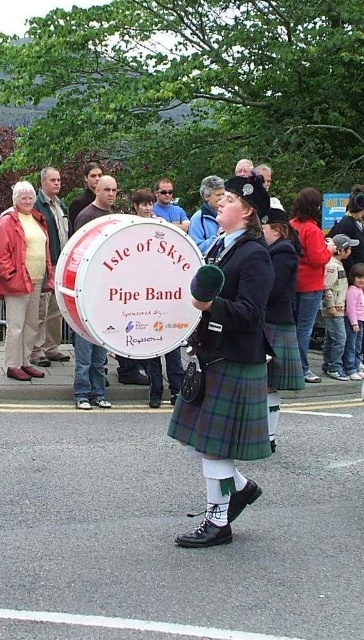
Can you confirm if matte green jacket at upper left is positioned below gray hair at upper center?

Yes.

Which is behind, point (41, 352) or point (250, 170)?

The point (250, 170) is behind.

Which is in front, point (49, 212) or point (239, 161)?

Point (49, 212) is more forward.

At what (x,y) coordinates should I click in order to perform the action: click on matte green jacket at upper left. Please return your answer as a coordinate pair (x, y). Image resolution: width=364 pixels, height=640 pixels. Looking at the image, I should click on (52, 211).

Does plaid fabric kilt at center have a greater height compared to matte black drum at upper center?

Indeed, plaid fabric kilt at center has a greater height compared to matte black drum at upper center.

The height and width of the screenshot is (640, 364). I want to click on plaid fabric kilt at center, so click(x=228, y=362).

Which is behind, point (252, 428) or point (173, 211)?

Positioned behind is point (173, 211).

At what (x,y) coordinates should I click in order to perform the action: click on plaid fabric kilt at center. Please return your answer as a coordinate pair (x, y). Looking at the image, I should click on point(228,362).

Does matte white drum at center have a lesser height compared to matte green jacket at upper left?

Incorrect, matte white drum at center's height does not fall short of matte green jacket at upper left's.

Is matte white drum at center further to the viewer compared to matte green jacket at upper left?

No.

Is point (104, 237) farther from camera compared to point (41, 353)?

No, it is not.

Locate an element on the screen. matte white drum at center is located at coordinates click(x=128, y=284).